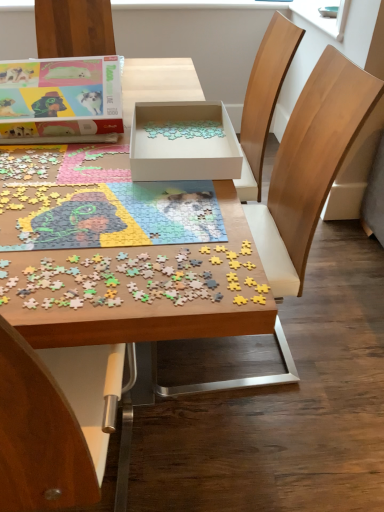
Question: From the image's perspective, is wooden puzzle pieces at center, marked as the 2th jigsaw puzzle in a bottom-to-top arrangement, located above or below white cardboard box at center, the second box when ordered from left to right?

Choices:
 (A) above
 (B) below

Answer: (B)

Question: From a real-world perspective, is wooden puzzle pieces at center, arranged as the 1th jigsaw puzzle when viewed from the back, positioned above or below white cardboard box at center, the second box when ordered from left to right?

Choices:
 (A) above
 (B) below

Answer: (B)

Question: Which object is the farthest from the wooden puzzle pieces at center, which is counted as the second jigsaw puzzle, starting from the top?

Choices:
 (A) wooden chair at center
 (B) matte cardboard box at upper left, placed as the first box when sorted from left to right
 (C) wooden puzzle pieces at center, marked as the 2th jigsaw puzzle in a bottom-to-top arrangement
 (D) white cardboard box at center, the second box when ordered from left to right
 (E) wooden puzzle pieces at center

Answer: (B)

Question: Which object is the closest to the wooden chair at center?

Choices:
 (A) matte cardboard box at upper left, placed as the 2th box when sorted from right to left
 (B) wooden puzzle pieces at center
 (C) white cardboard box at center, the 1th box in the right-to-left sequence
 (D) wooden puzzle pieces at center, which is counted as the second jigsaw puzzle, starting from the top
 (E) wooden puzzle pieces at center, marked as the 2th jigsaw puzzle in a bottom-to-top arrangement

Answer: (C)